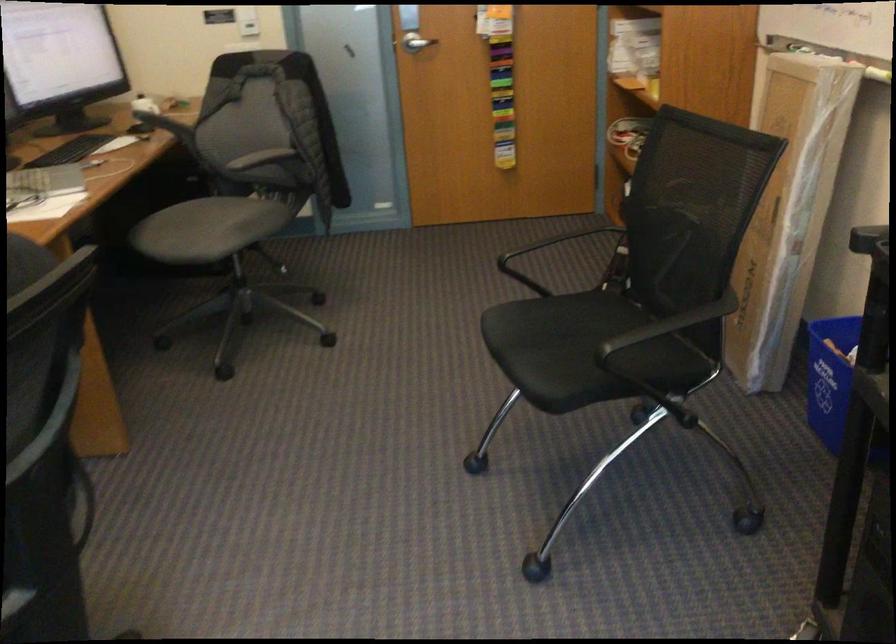
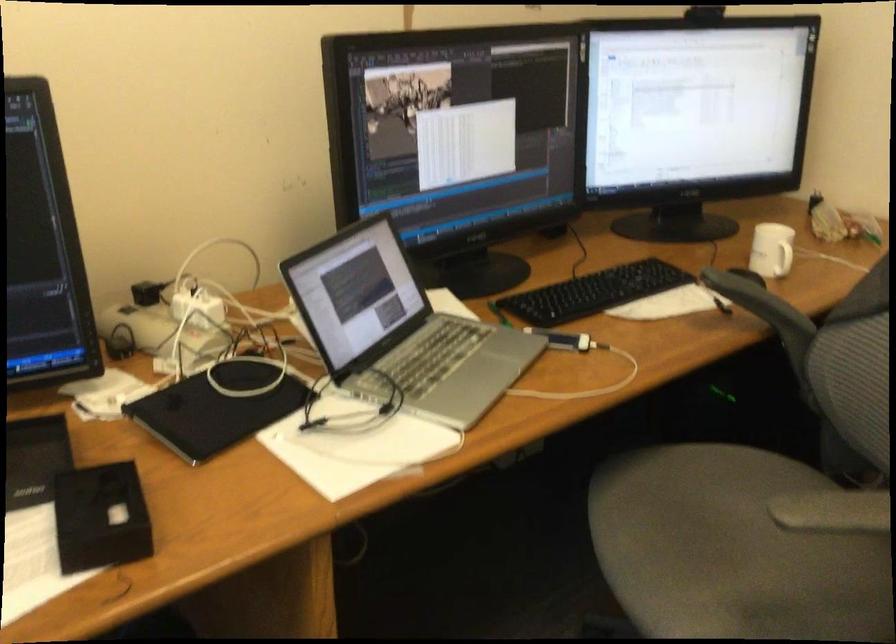
In the second image, find the point that corresponds to (218,223) in the first image.

(733, 550)